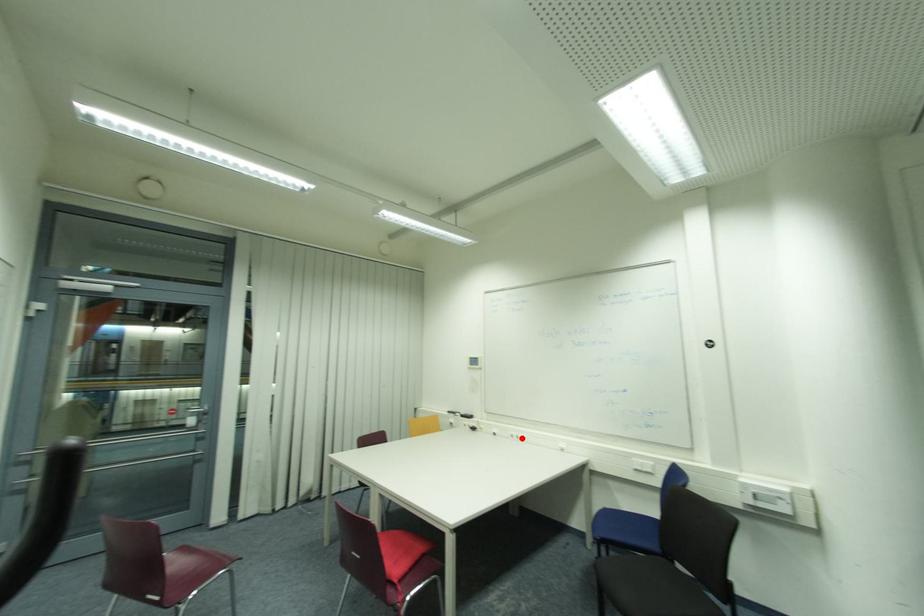
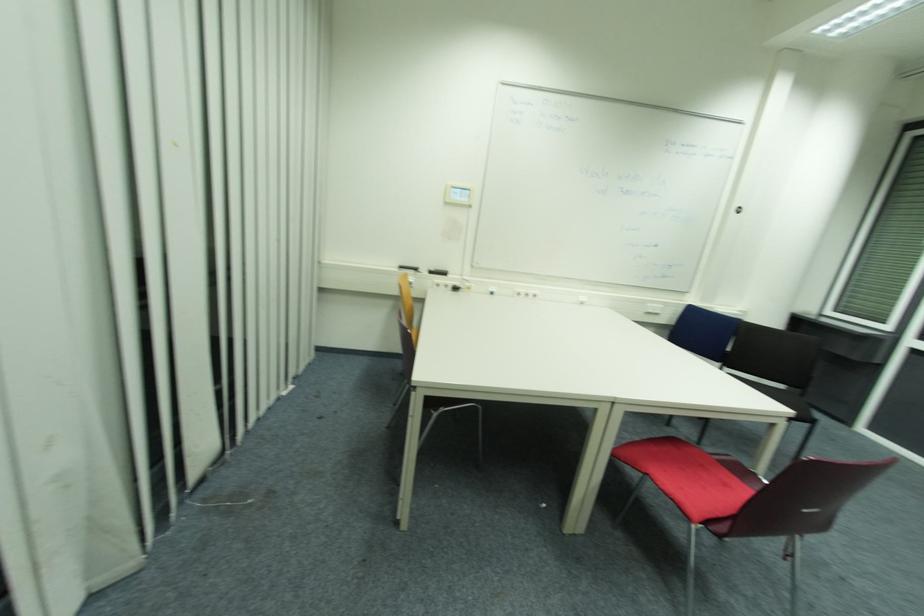
Where in the second image is the point corresponding to the highlighted location from the first image?

(529, 294)